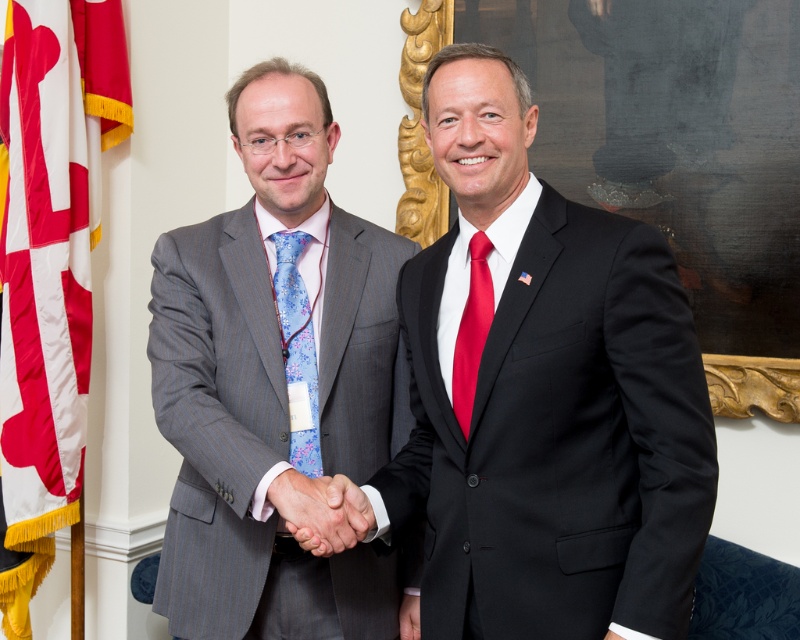
Is matte black suit at right to the left of gray pinstripe suit at center from the viewer's perspective?

In fact, matte black suit at right is to the right of gray pinstripe suit at center.

The width and height of the screenshot is (800, 640). I want to click on matte black suit at right, so click(545, 396).

Who is positioned more to the right, gray pinstripe suit at center or red satin tie at center?

red satin tie at center is more to the right.

Is point (156, 400) positioned behind point (458, 392)?

That is True.

Describe the element at coordinates (274, 385) in the screenshot. I see `gray pinstripe suit at center` at that location.

Locate an element on the screen. The height and width of the screenshot is (640, 800). gray pinstripe suit at center is located at coordinates (274, 385).

Can you confirm if white satin flag at left is positioned above black wood picture frame at right?

Actually, white satin flag at left is below black wood picture frame at right.

Who is more distant from viewer, [16,465] or [712,376]?

The point [16,465] is behind.

At what (x,y) coordinates should I click in order to perform the action: click on white satin flag at left. Please return your answer as a coordinate pair (x, y). Looking at the image, I should click on (44, 273).